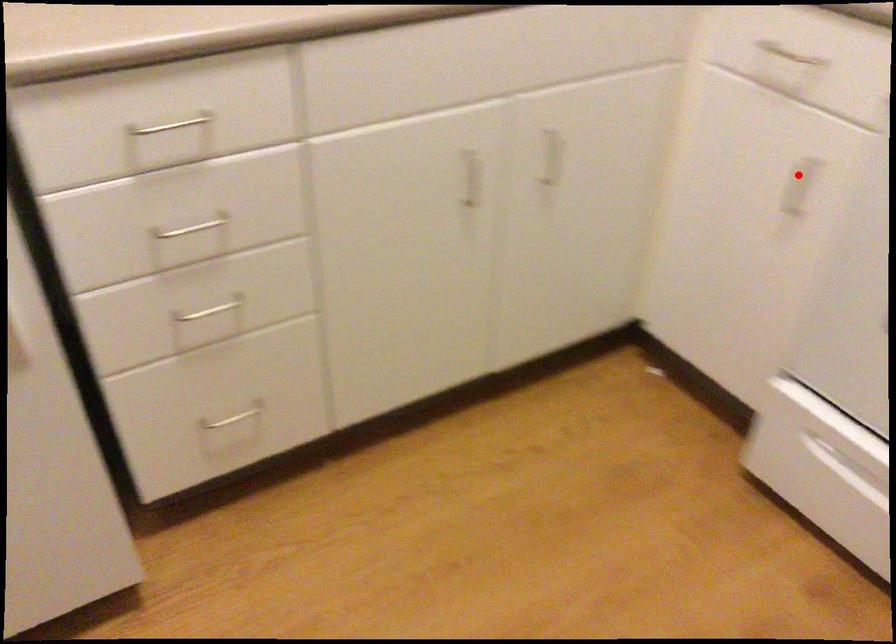
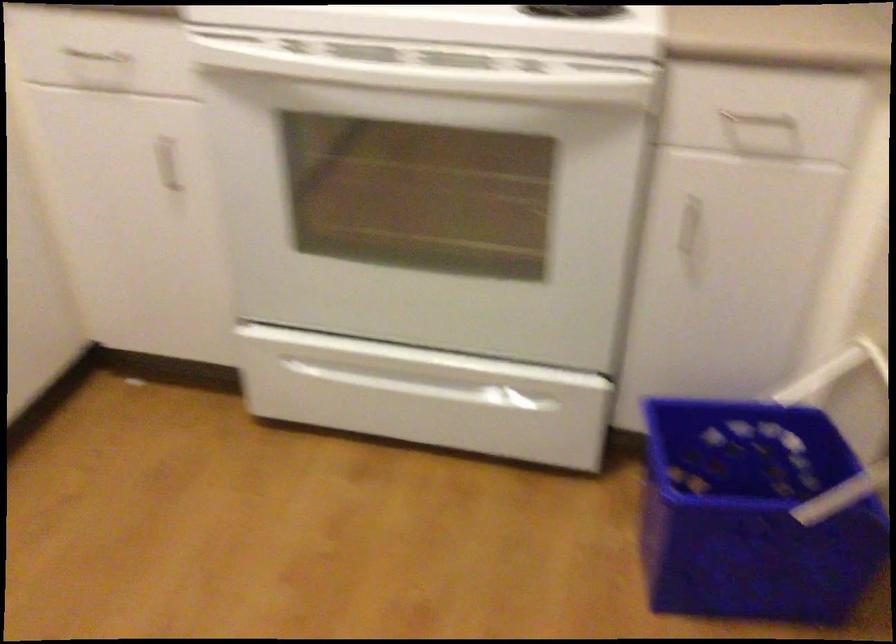
Question: A red point is marked in image1. In image2, is the corresponding 3D point closer to the camera or farther? Reply with the corresponding letter.

Choices:
 (A) The corresponding 3D point is closer.
 (B) The corresponding 3D point is farther.

Answer: (B)